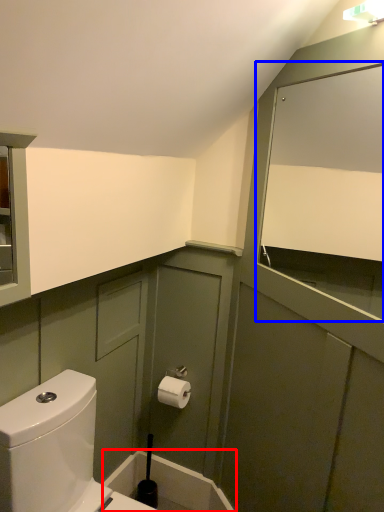
Question: Which object is closer to the camera taking this photo, bath (highlighted by a red box) or mirror (highlighted by a blue box)?

Choices:
 (A) bath
 (B) mirror

Answer: (B)